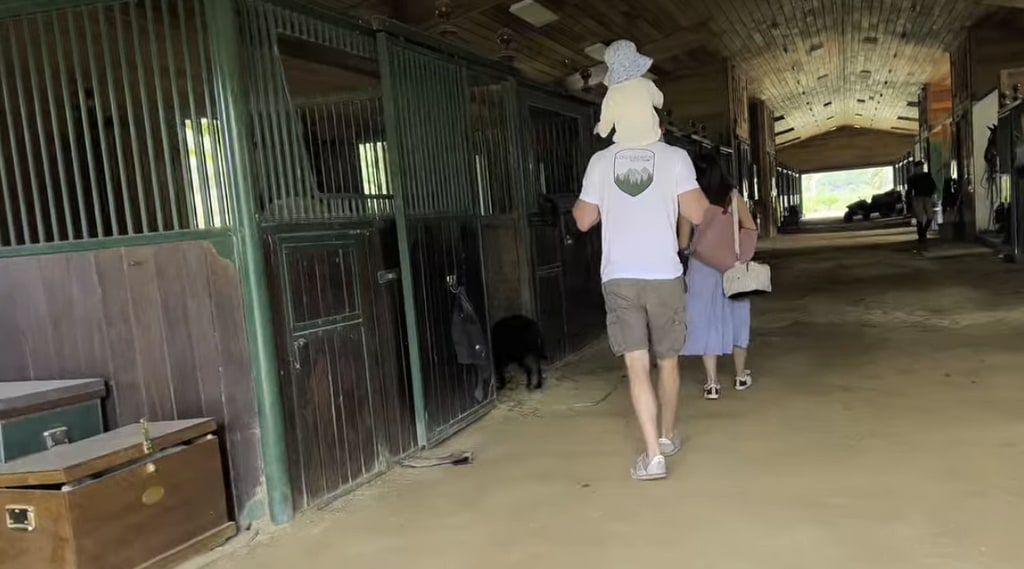
This screenshot has width=1024, height=569. Identify the location of door. (316, 313).